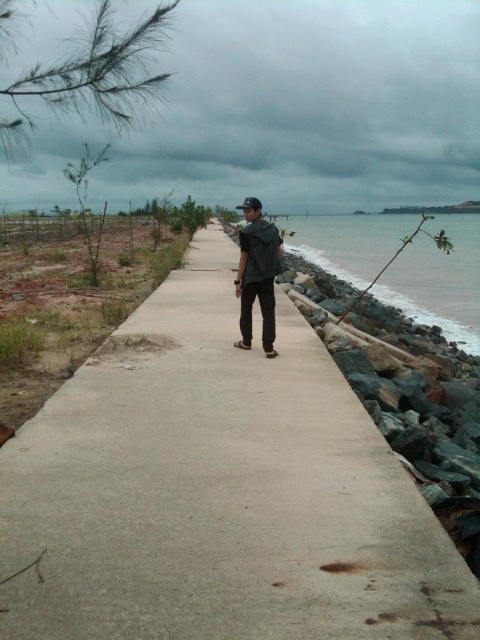
You are standing on the concrete pathway and want to place a small potted plant exactly at point (217, 492). According to the scene description, what will be under the potted plant?

The point (217, 492) has concrete at center, so placing the potted plant there will have the concrete underneath.